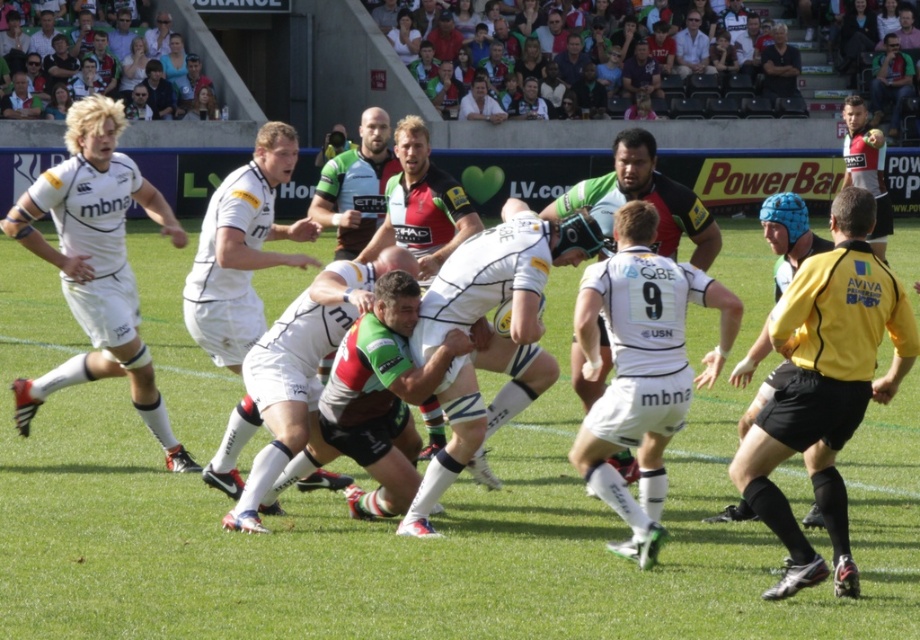
Question: Observing the image, what is the correct spatial positioning of yellow jersey at right in reference to reddish-brown jersey at center?

Choices:
 (A) right
 (B) left

Answer: (A)

Question: Which point is closer to the camera taking this photo?

Choices:
 (A) (409, 248)
 (B) (634, 618)
 (C) (380, 179)

Answer: (B)

Question: Which point is closer to the camera?

Choices:
 (A) (690, 52)
 (B) (53, 252)
 (C) (221, 442)
 (D) (308, 432)

Answer: (D)

Question: Is green grass football field at center bigger than reddish-brown jersey at center?

Choices:
 (A) no
 (B) yes

Answer: (B)

Question: Is white matte jersey at left positioned at the back of white shirt at upper center?

Choices:
 (A) no
 (B) yes

Answer: (A)

Question: Which object is closer to the camera taking this photo?

Choices:
 (A) green jersey at center
 (B) white matte jersey at center
 (C) camouflage-patterned shorts at center

Answer: (C)